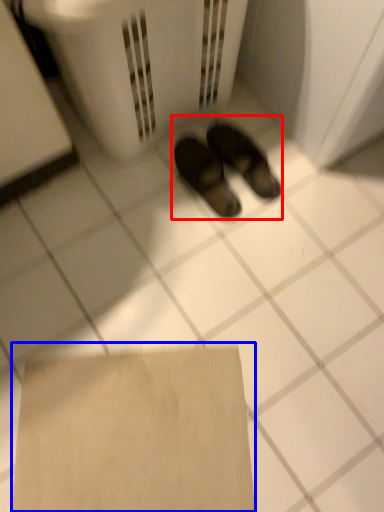
Question: Which object is further to the camera taking this photo, footwear (highlighted by a red box) or cardboard (highlighted by a blue box)?

Choices:
 (A) footwear
 (B) cardboard

Answer: (A)